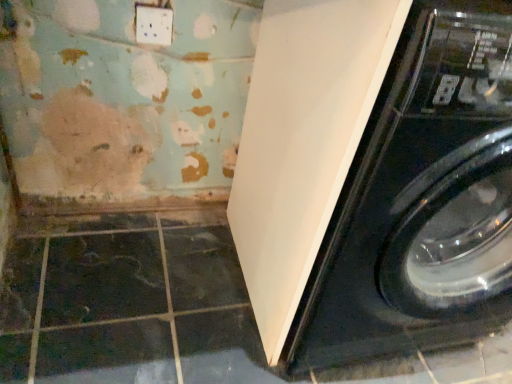
Question: In which direction should I rotate to look at white plastic electric outlet at upper center?

Choices:
 (A) right
 (B) left

Answer: (B)

Question: Is white glossy washing machine at lower right not near white plastic electric outlet at upper center?

Choices:
 (A) no
 (B) yes

Answer: (A)

Question: Is white plastic electric outlet at upper center surrounded by white glossy washing machine at lower right?

Choices:
 (A) yes
 (B) no

Answer: (B)

Question: From the image's perspective, is white glossy washing machine at lower right under white plastic electric outlet at upper center?

Choices:
 (A) no
 (B) yes

Answer: (B)

Question: Is white glossy washing machine at lower right looking in the opposite direction of white plastic electric outlet at upper center?

Choices:
 (A) no
 (B) yes

Answer: (A)

Question: Does white glossy washing machine at lower right have a lesser width compared to white plastic electric outlet at upper center?

Choices:
 (A) no
 (B) yes

Answer: (A)

Question: Is white glossy washing machine at lower right taller than white plastic electric outlet at upper center?

Choices:
 (A) no
 (B) yes

Answer: (B)

Question: Is white plastic electric outlet at upper center wider than white glossy washing machine at lower right?

Choices:
 (A) no
 (B) yes

Answer: (A)

Question: Can you confirm if white plastic electric outlet at upper center is bigger than white glossy washing machine at lower right?

Choices:
 (A) yes
 (B) no

Answer: (B)

Question: Is white plastic electric outlet at upper center at the right side of white glossy washing machine at lower right?

Choices:
 (A) no
 (B) yes

Answer: (A)

Question: Is white plastic electric outlet at upper center looking in the opposite direction of white glossy washing machine at lower right?

Choices:
 (A) yes
 (B) no

Answer: (B)

Question: From the image's perspective, does white plastic electric outlet at upper center appear lower than white glossy washing machine at lower right?

Choices:
 (A) no
 (B) yes

Answer: (A)

Question: From a real-world perspective, is white plastic electric outlet at upper center physically below white glossy washing machine at lower right?

Choices:
 (A) yes
 (B) no

Answer: (B)

Question: Do you think white glossy washing machine at lower right is within white plastic electric outlet at upper center, or outside of it?

Choices:
 (A) inside
 (B) outside

Answer: (B)